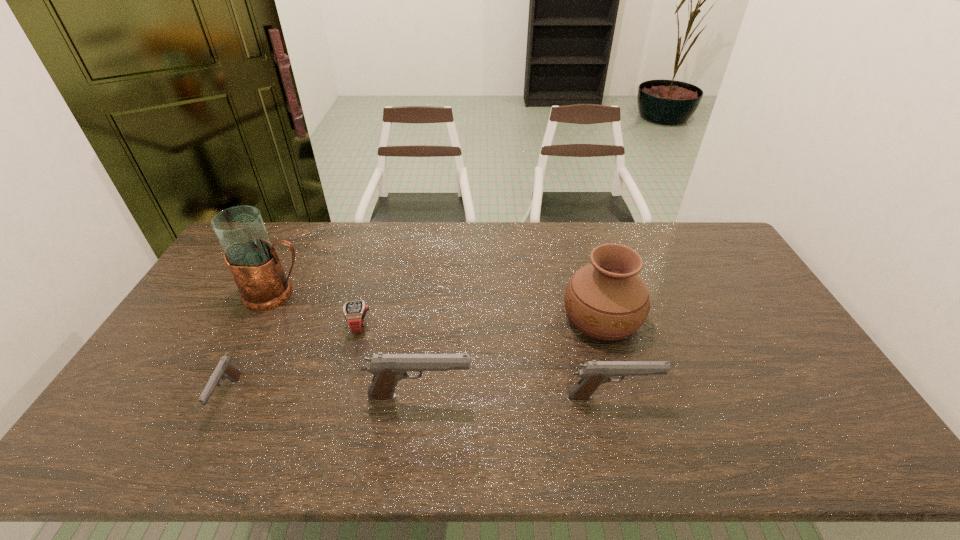
Find the location of a particular element. free region located 0.170m on the front of the fourth object from right to left is located at coordinates (343, 388).

Where is `vacant area situated with the handle on the side of the tallest object`? This screenshot has height=540, width=960. vacant area situated with the handle on the side of the tallest object is located at coordinates [401, 294].

Image resolution: width=960 pixels, height=540 pixels. What are the coordinates of `free space located on the right of the urn` in the screenshot? It's located at (708, 316).

The width and height of the screenshot is (960, 540). Identify the location of object positioned at the left edge. coord(252,259).

Where is `free region at the far edge`? free region at the far edge is located at coordinates (636, 241).

Image resolution: width=960 pixels, height=540 pixels. I want to click on free space at the near edge of the desktop, so click(568, 399).

Identify the location of free space at the left edge of the desktop. (225, 279).

Find the location of a particular element. free region at the far right corner of the desktop is located at coordinates (684, 225).

You are a GUI agent. You are given a task and a screenshot of the screen. Output one action in this format:
    pyautogui.click(x=<x>, y=<y>)
    Task: Click on the free point between the urn and the pitcher
    
    Given the screenshot: What is the action you would take?
    point(439,306)

Locate an element on the screen. The image size is (960, 540). free space between the pitcher and the fifth shortest object is located at coordinates (439, 306).